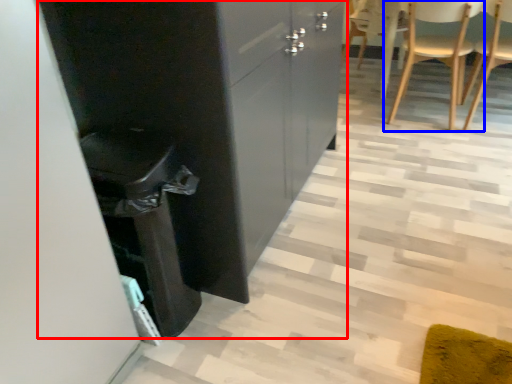
Question: Which of the following is the closest to the observer, cabinetry (highlighted by a red box) or chair (highlighted by a blue box)?

Choices:
 (A) cabinetry
 (B) chair

Answer: (A)